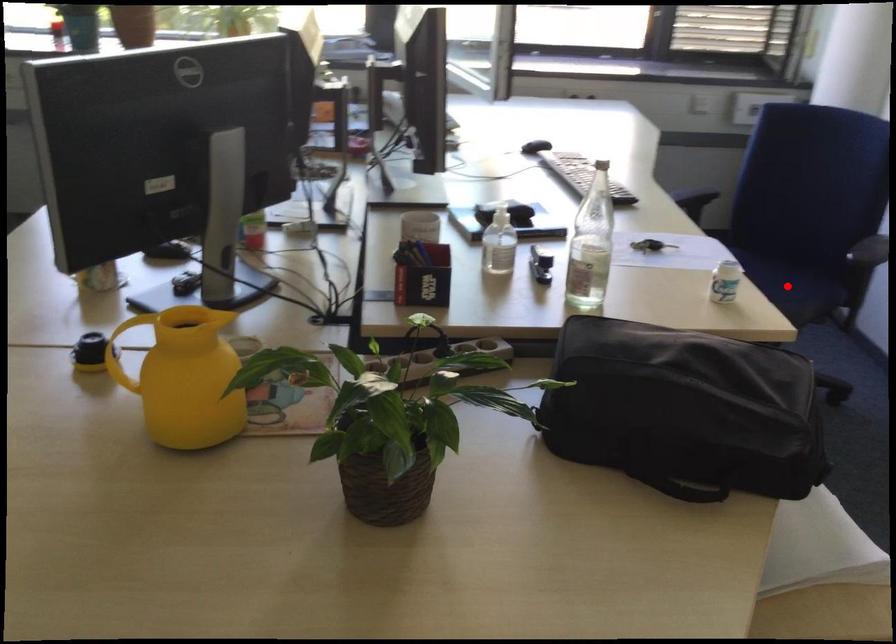
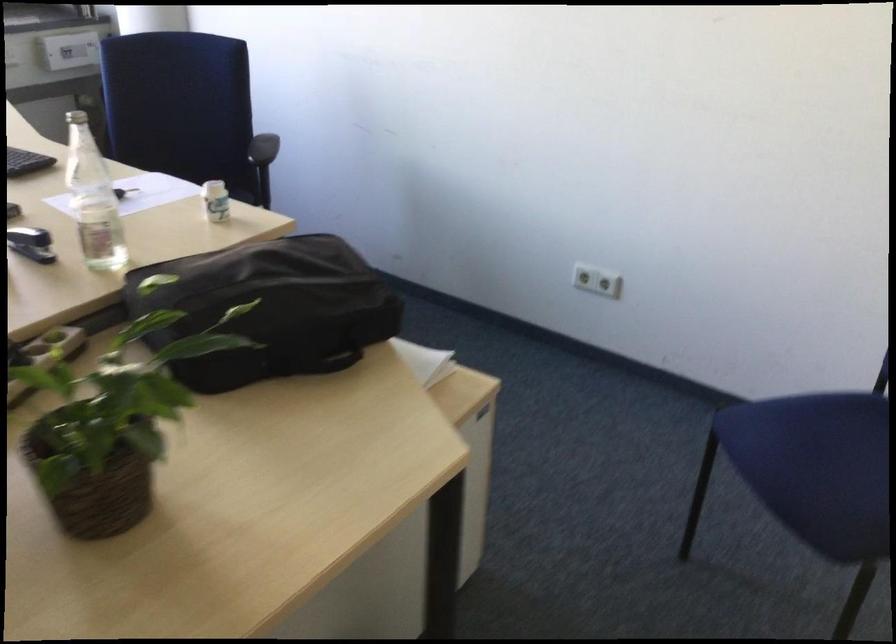
Question: I am providing you with two images of the same scene from different viewpoints. A red point is marked on the first image. At the location where the point appears in image 1, is it still visible in image 2?

Choices:
 (A) Yes
 (B) No

Answer: (B)